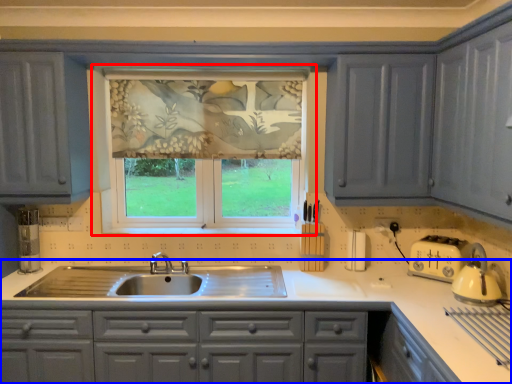
Question: Which of the following is the farthest to the observer, window (highlighted by a red box) or countertop (highlighted by a blue box)?

Choices:
 (A) window
 (B) countertop

Answer: (A)